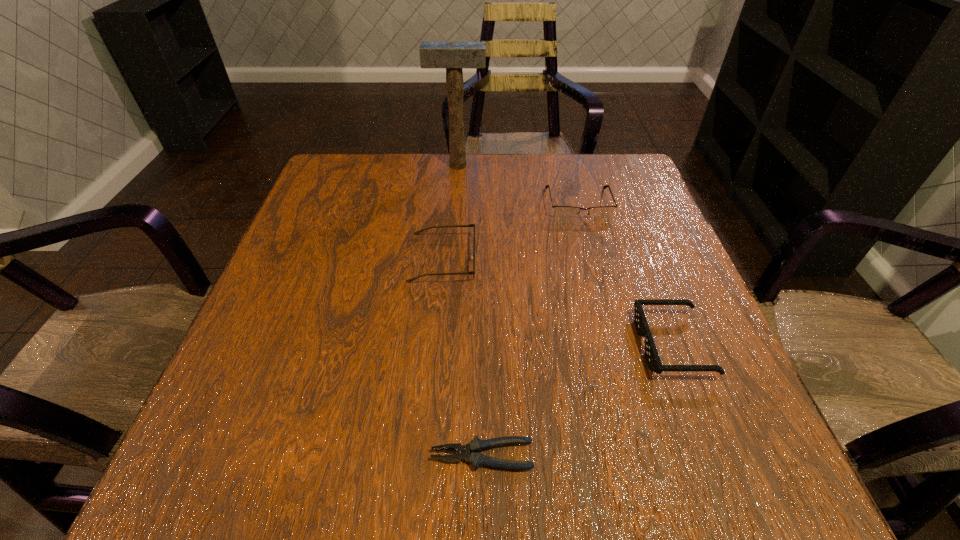
The height and width of the screenshot is (540, 960). Find the location of `empty space that is in between the mallet and the right spectacles`. empty space that is in between the mallet and the right spectacles is located at coordinates (518, 185).

Find the location of `the third closest object to the right spectacles`. the third closest object to the right spectacles is located at coordinates 651,354.

Select which object appears as the closest to the farther spectacles. Please provide its 2D coordinates. Your answer should be formatted as a tuple, i.e. [(x, y)], where the tuple contains the x and y coordinates of a point satisfying the conditions above.

[(453, 56)]